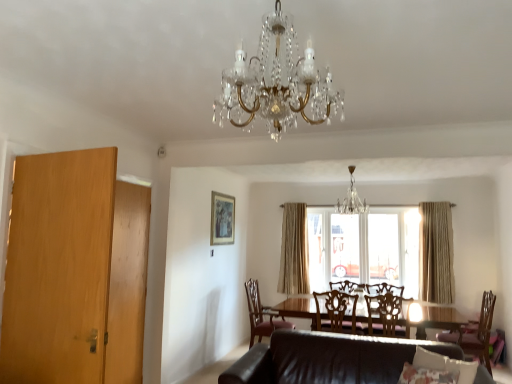
What do you see at coordinates (384, 315) in the screenshot?
I see `wooden chair at center, marked as the third chair in a left-to-right arrangement` at bounding box center [384, 315].

I want to click on wooden chair at center, marked as the third chair in a left-to-right arrangement, so click(384, 315).

This screenshot has width=512, height=384. Describe the element at coordinates (336, 312) in the screenshot. I see `wooden chair at center, which is counted as the third chair, starting from the right` at that location.

The height and width of the screenshot is (384, 512). What do you see at coordinates (294, 251) in the screenshot?
I see `beige fabric curtain at center, the first curtain viewed from the left` at bounding box center [294, 251].

Based on the photo, in order to face wooden chair at lower right, the fourth chair viewed from the left, should I rotate leftwards or rightwards?

A 26.251 degree turn to the right will do.

The image size is (512, 384). What are the coordinates of `light brown wood armoire at left` in the screenshot? It's located at (127, 284).

Locate an element on the screen. wooden chair at center, marked as the third chair in a left-to-right arrangement is located at coordinates (384, 315).

How much distance is there between beige fabric curtain at center, which is the second curtain in front-to-back order, and transparent glass window at center?

The distance of beige fabric curtain at center, which is the second curtain in front-to-back order, from transparent glass window at center is 25.09 inches.

Which object is further away from the camera, beige fabric curtain at center, the first curtain viewed from the left, or transparent glass window at center?

beige fabric curtain at center, the first curtain viewed from the left.

Between beige fabric curtain at center, placed as the first curtain when sorted from back to front, and transparent glass window at center, which one has larger size?

transparent glass window at center.

Considering the sizes of beige fabric curtain at center, the first curtain viewed from the left, and transparent glass window at center in the image, is beige fabric curtain at center, the first curtain viewed from the left, taller or shorter than transparent glass window at center?

Clearly, beige fabric curtain at center, the first curtain viewed from the left, is taller compared to transparent glass window at center.

Which object is more forward, gold-framed picture at upper center or wooden chair at lower right, the fourth chair viewed from the left?

wooden chair at lower right, the fourth chair viewed from the left.

Are gold-framed picture at upper center and wooden chair at lower right, the fourth chair viewed from the left, located far from each other?

That's right, there is a large distance between gold-framed picture at upper center and wooden chair at lower right, the fourth chair viewed from the left.

In the scene shown: Is gold-framed picture at upper center facing away from wooden chair at lower right, the fourth chair viewed from the left?

No, gold-framed picture at upper center is not facing away from wooden chair at lower right, the fourth chair viewed from the left.

Is gold-framed picture at upper center thinner than wooden chair at lower right, the fourth chair viewed from the left?

Yes.

What's the angular difference between beige fabric curtain at center, which is the second curtain in front-to-back order, and crystal glass chandelier at center, the second chandelier from the front,'s facing directions?

1.05 degrees separate the facing orientations of beige fabric curtain at center, which is the second curtain in front-to-back order, and crystal glass chandelier at center, the second chandelier from the front.

Is beige fabric curtain at center, the first curtain viewed from the left, spatially inside crystal glass chandelier at center, which ranks as the 1th chandelier in back-to-front order, or outside of it?

beige fabric curtain at center, the first curtain viewed from the left, exists outside the volume of crystal glass chandelier at center, which ranks as the 1th chandelier in back-to-front order.

Between beige fabric curtain at center, which is the second curtain in front-to-back order, and crystal glass chandelier at center, positioned as the first chandelier in right-to-left order, which one has smaller width?

beige fabric curtain at center, which is the second curtain in front-to-back order, is thinner.

Which is in front, point (287, 216) or point (344, 205)?

The point (344, 205) is in front.

Between point (329, 320) and point (485, 350), which one is positioned behind?

The point (329, 320) is farther.

From the picture: Is wooden chair at center, which is counted as the third chair, starting from the right, to the left of wooden chair at lower right, the fourth chair viewed from the left, from the viewer's perspective?

Yes, wooden chair at center, which is counted as the third chair, starting from the right, is to the left of wooden chair at lower right, the fourth chair viewed from the left.

Which object is closer to the camera, wooden chair at center, which is counted as the second chair, starting from the left, or wooden chair at lower right, the fourth chair viewed from the left?

wooden chair at lower right, the fourth chair viewed from the left, is more forward.

From a real-world perspective, which is physically below, wooden chair at center, which is counted as the second chair, starting from the left, or leather couch at lower center?

In real-world perspective, leather couch at lower center is lower.

Is there a large distance between wooden chair at center, which is counted as the second chair, starting from the left, and leather couch at lower center?

wooden chair at center, which is counted as the second chair, starting from the left, is actually quite close to leather couch at lower center.

Which of these two, wooden chair at center, which is counted as the second chair, starting from the left, or leather couch at lower center, is bigger?

Bigger between the two is leather couch at lower center.

Considering the relative positions of beige fabric curtain at center, acting as the second curtain starting from the right, and brown leather chair at lower center, arranged as the fourth chair when viewed from the right, in the image provided, is beige fabric curtain at center, acting as the second curtain starting from the right, to the left of brown leather chair at lower center, arranged as the fourth chair when viewed from the right, from the viewer's perspective?

Incorrect, beige fabric curtain at center, acting as the second curtain starting from the right, is not on the left side of brown leather chair at lower center, arranged as the fourth chair when viewed from the right.

Measure the distance from beige fabric curtain at center, placed as the first curtain when sorted from back to front, to brown leather chair at lower center, arranged as the fourth chair when viewed from the right.

A distance of 75.91 centimeters exists between beige fabric curtain at center, placed as the first curtain when sorted from back to front, and brown leather chair at lower center, arranged as the fourth chair when viewed from the right.

What's the angular difference between beige fabric curtain at center, acting as the second curtain starting from the right, and brown leather chair at lower center, arranged as the fourth chair when viewed from the right,'s facing directions?

They differ by 86.2 degrees in their facing directions.

From a real-world perspective, which object stands above the other?

From a 3D spatial view, beige fabric curtain at center, placed as the first curtain when sorted from back to front, is above.

How many degrees apart are the facing directions of crystal/glass chandelier at center, which is counted as the first chandelier, starting from the left, and wooden chair at center, which is counted as the third chair, starting from the right?

crystal/glass chandelier at center, which is counted as the first chandelier, starting from the left, and wooden chair at center, which is counted as the third chair, starting from the right, are facing 5.09 degrees away from each other.

In terms of height, does crystal/glass chandelier at center, acting as the 2th chandelier starting from the right, look taller or shorter compared to wooden chair at center, which is counted as the second chair, starting from the left?

crystal/glass chandelier at center, acting as the 2th chandelier starting from the right, is taller than wooden chair at center, which is counted as the second chair, starting from the left.

Is point (263, 30) closer to camera compared to point (337, 303)?

Yes, it is.

Is crystal/glass chandelier at center, arranged as the 2th chandelier when viewed from the back, directly adjacent to wooden chair at center, which is counted as the second chair, starting from the left?

crystal/glass chandelier at center, arranged as the 2th chandelier when viewed from the back, and wooden chair at center, which is counted as the second chair, starting from the left, are clearly separated.

The image size is (512, 384). In order to click on window directly beneath the beige fabric curtain at center, which is the second curtain in front-to-back order (from a real-world perspective) in this screenshot , I will do pos(377,248).

From the image's perspective, which chair is the 3rd one below the gold-framed picture at upper center? Please provide its 2D coordinates.

[(476, 333)]

Based on their spatial positions, is wooden door at left or brown leather chair at lower center, arranged as the fourth chair when viewed from the right, closer to fluffy fabric pillow at lower center?

The object closer to fluffy fabric pillow at lower center is wooden door at left.

Based on their spatial positions, is leather couch at lower center or crystal glass chandelier at center, the 2th chandelier from the left, further from wooden chair at center, which is counted as the second chair, starting from the left?

crystal glass chandelier at center, the 2th chandelier from the left.

From the image, which object appears to be nearer to light brown wood armoire at left, leather couch at lower center or wooden chair at center, which appears as the second chair when viewed from the right?

The object closer to light brown wood armoire at left is leather couch at lower center.

In the scene shown: Based on their spatial positions, is wooden chair at lower right, the 1th chair positioned from the right, or gold-framed picture at upper center closer to fluffy fabric pillow at lower center?

wooden chair at lower right, the 1th chair positioned from the right, lies closer to fluffy fabric pillow at lower center than the other object.

Based on the photo, based on their spatial positions, is light brown wood armoire at left or wooden chair at center, which is counted as the second chair, starting from the left, closer to wooden chair at center, marked as the third chair in a left-to-right arrangement?

wooden chair at center, which is counted as the second chair, starting from the left, is positioned closer to the anchor wooden chair at center, marked as the third chair in a left-to-right arrangement.

When comparing their distances from wooden chair at lower right, the fourth chair viewed from the left, does leather couch at lower center or crystal glass chandelier at center, positioned as the first chandelier in right-to-left order, seem closer?

leather couch at lower center lies closer to wooden chair at lower right, the fourth chair viewed from the left, than the other object.

When comparing their distances from leather couch at lower center, does beige fabric curtain at center, which is the second curtain in front-to-back order, or crystal/glass chandelier at center, arranged as the 2th chandelier when viewed from the back, seem further?

The object further to leather couch at lower center is beige fabric curtain at center, which is the second curtain in front-to-back order.

Looking at the image, which one is located closer to beige fabric curtain at center, which is the second curtain in front-to-back order, light brown wood armoire at left or fluffy fabric pillow at lower center?

Among the two, light brown wood armoire at left is located nearer to beige fabric curtain at center, which is the second curtain in front-to-back order.

The width and height of the screenshot is (512, 384). I want to click on curtain between gold-framed picture at upper center and transparent glass window at center, so click(x=294, y=251).

You are a GUI agent. You are given a task and a screenshot of the screen. Output one action in this format:
    pyautogui.click(x=<x>, y=<y>)
    Task: Click on the pillow positioned between wooden door at left and beige textured curtain at right, which is counted as the 2th curtain, starting from the back, from near to far
    
    Given the screenshot: What is the action you would take?
    pyautogui.click(x=445, y=365)

The image size is (512, 384). I want to click on chandelier located between wooden chair at center, which is counted as the third chair, starting from the right, and transparent glass window at center in the depth direction, so click(x=351, y=198).

What are the coordinates of `chair between fluffy fabric pillow at lower center and wooden chair at lower right, the 1th chair positioned from the right, in the front-back direction` in the screenshot? It's located at (384, 315).